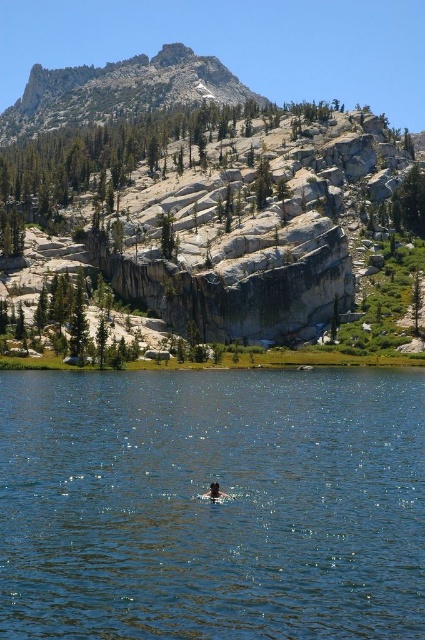
Describe the element at coordinates (119, 92) in the screenshot. I see `rugged granite peak at upper center` at that location.

Does rugged granite peak at upper center appear on the left side of brown hair at center?

Correct, you'll find rugged granite peak at upper center to the left of brown hair at center.

The height and width of the screenshot is (640, 425). I want to click on rugged granite peak at upper center, so click(x=119, y=92).

You are a GUI agent. You are given a task and a screenshot of the screen. Output one action in this format:
    pyautogui.click(x=<x>, y=<y>)
    Task: Click on the rugged granite peak at upper center
    
    Given the screenshot: What is the action you would take?
    pyautogui.click(x=119, y=92)

Is blue water at center thinner than gray/rocky mountain at upper center?

Indeed, blue water at center has a lesser width compared to gray/rocky mountain at upper center.

Does blue water at center come behind gray/rocky mountain at upper center?

No, it is not.

Which is in front, point (286, 465) or point (178, 284)?

Point (286, 465)

In order to click on blue water at center in this screenshot , I will do `click(212, 504)`.

Does gray/rocky mountain at upper center appear over rugged granite peak at upper center?

No, gray/rocky mountain at upper center is not above rugged granite peak at upper center.

Can you confirm if gray/rocky mountain at upper center is smaller than rugged granite peak at upper center?

No, gray/rocky mountain at upper center is not smaller than rugged granite peak at upper center.

Does point (295, 282) lie in front of point (42, 76)?

That is True.

Locate an element on the screen. The image size is (425, 640). gray/rocky mountain at upper center is located at coordinates (221, 204).